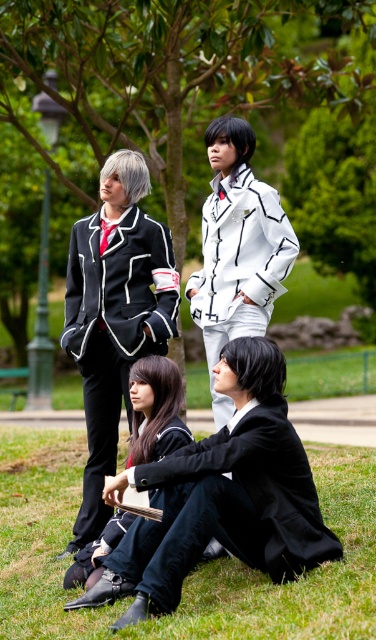
Question: Is green grass at lower center closer to the viewer compared to matte black suit at left?

Choices:
 (A) yes
 (B) no

Answer: (A)

Question: In this image, where is green grass at lower center located relative to satin black dress at lower center?

Choices:
 (A) right
 (B) left

Answer: (A)

Question: Which is farther from the white matte jacket at center?

Choices:
 (A) green grass at lower center
 (B) matte black suit at left
 (C) satin black dress at lower center

Answer: (A)

Question: Which object is positioned closest to the matte black suit at left?

Choices:
 (A) satin black dress at lower center
 (B) green grass at lower center

Answer: (A)

Question: Can you confirm if green grass at lower center is positioned to the right of white matte jacket at center?

Choices:
 (A) no
 (B) yes

Answer: (A)

Question: Which point is farther to the camera?

Choices:
 (A) satin black dress at lower center
 (B) matte black suit at left
 (C) green grass at lower center
 (D) white matte jacket at center

Answer: (B)